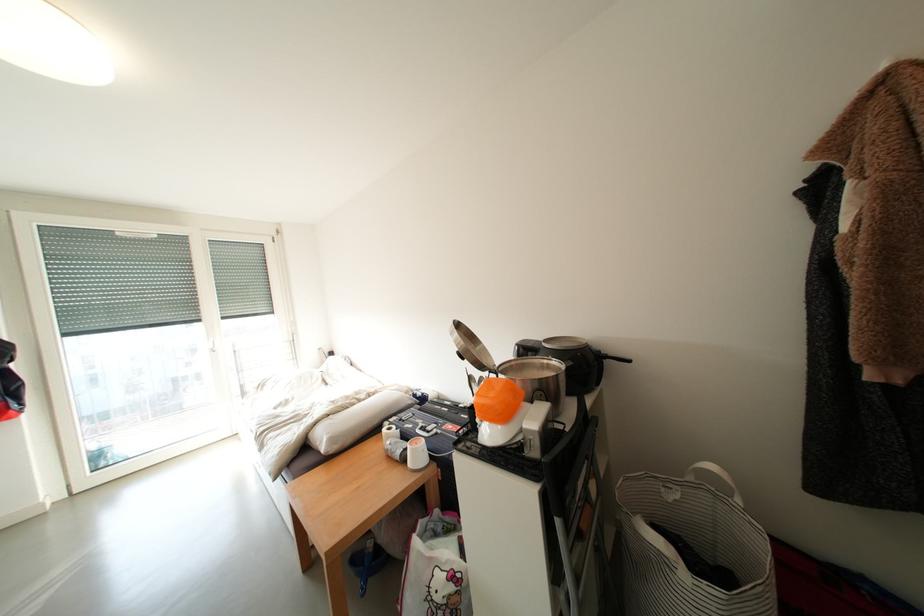
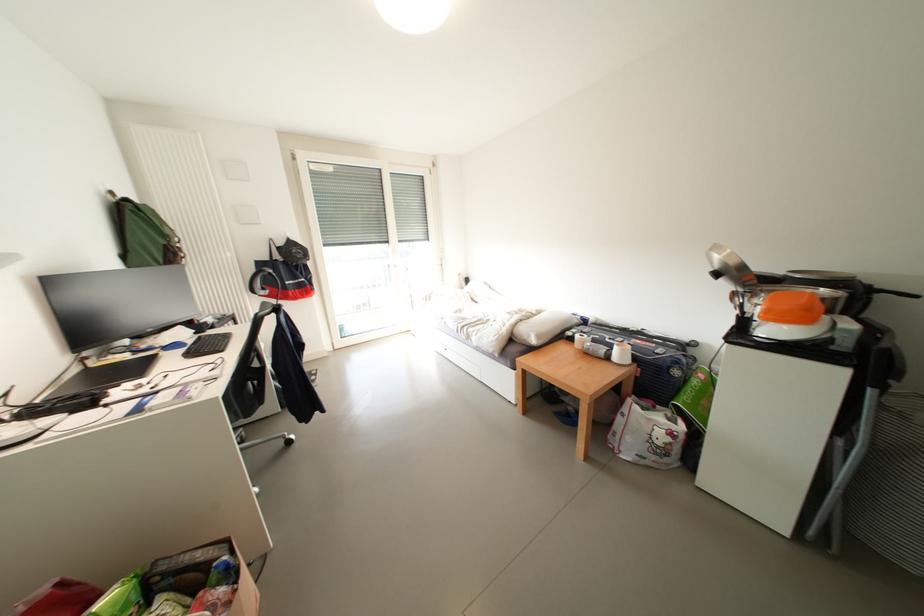
Find the pixel in the second image that matches (x=325, y=446) in the first image.

(532, 341)